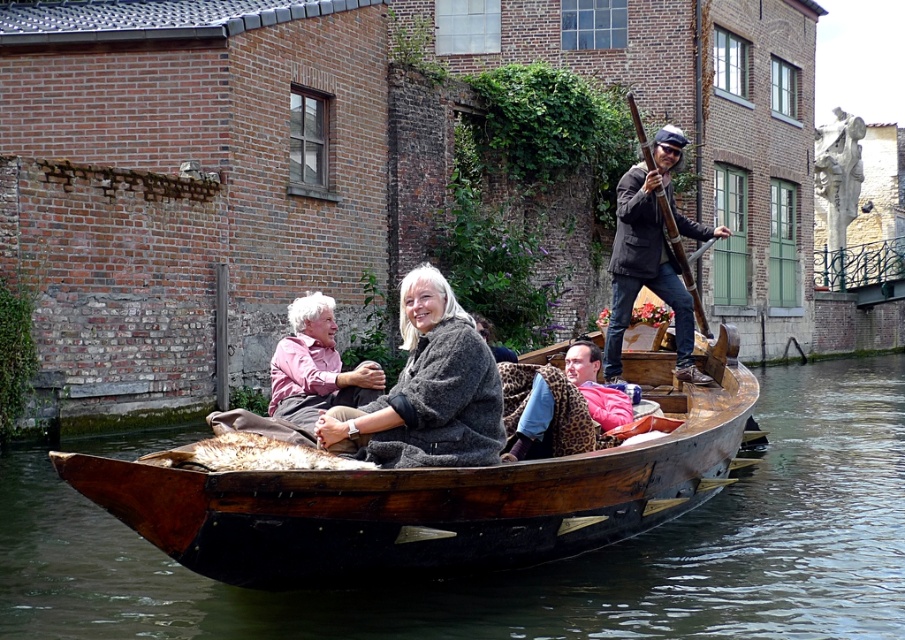
Is wooden canoe at center smaller than leopard print jacket at center?

No.

Is point (329, 474) behind point (567, 433)?

No.

Who is more distant from viewer, (661, 504) or (521, 394)?

Positioned behind is point (661, 504).

The height and width of the screenshot is (640, 905). Identify the location of wooden canoe at center. (434, 497).

Does point (667, 300) come behind point (313, 381)?

Yes, it is behind point (313, 381).

Who is more forward, [684,321] or [311,348]?

Point [311,348] is in front.

Which is behind, point (691, 348) or point (293, 340)?

The point (691, 348) is behind.

The height and width of the screenshot is (640, 905). In order to click on dark brown leather jacket at upper right in this screenshot , I will do `click(651, 256)`.

Measure the distance between point (614, 332) and camera.

Point (614, 332) is 45.70 meters away from camera.

Which of these two, dark brown leather jacket at upper right or leopard print jacket at center, stands shorter?

With less height is leopard print jacket at center.

Between point (618, 196) and point (551, 380), which one is positioned in front?

Positioned in front is point (551, 380).

You are a GUI agent. You are given a task and a screenshot of the screen. Output one action in this format:
    pyautogui.click(x=<x>, y=<y>)
    Task: Click on the dark brown leather jacket at upper right
    This screenshot has height=640, width=905.
    Given the screenshot: What is the action you would take?
    pyautogui.click(x=651, y=256)